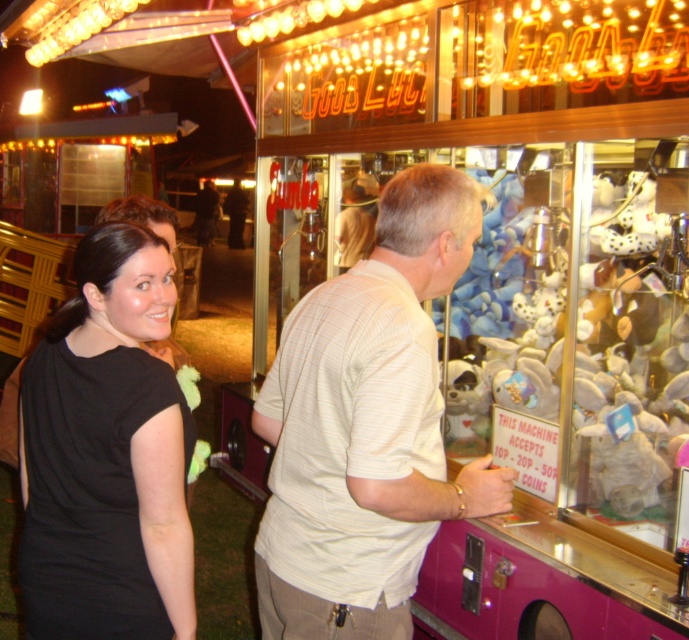
Question: Is light beige striped shirt at center smaller than black fabric dress at left?

Choices:
 (A) yes
 (B) no

Answer: (B)

Question: Can you confirm if light beige striped shirt at center is positioned to the left of black fabric dress at left?

Choices:
 (A) yes
 (B) no

Answer: (B)

Question: Among these points, which one is nearest to the camera?

Choices:
 (A) (409, 230)
 (B) (143, 419)

Answer: (B)

Question: Among these objects, which one is farthest from the camera?

Choices:
 (A) black fabric dress at left
 (B) light beige striped shirt at center

Answer: (A)

Question: Can you confirm if light beige striped shirt at center is bigger than black fabric dress at left?

Choices:
 (A) yes
 (B) no

Answer: (A)